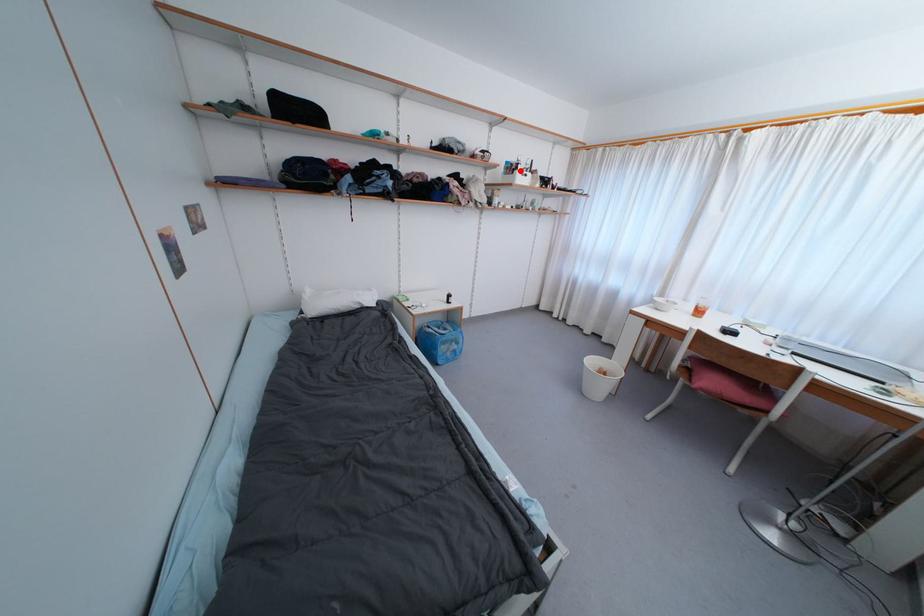
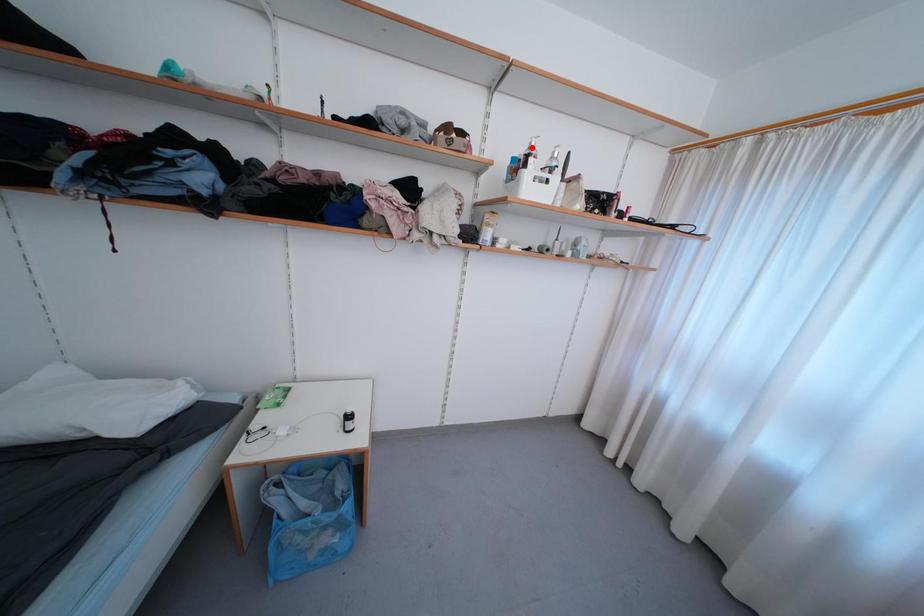
I am providing you with two images of the same scene from different viewpoints. A red point is marked on the first image and another point is marked on the second image. Does the point marked in image1 correspond to the same location as the one in image2?

No